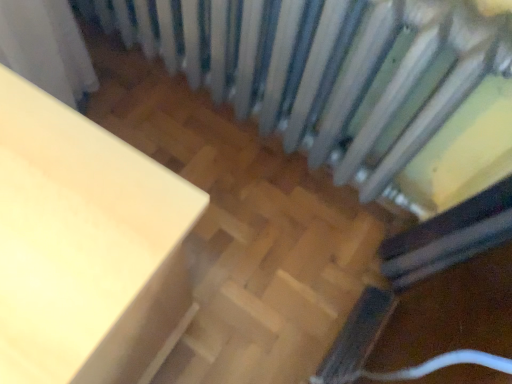
Identify the location of white painted radiator at upper center. (331, 72).

The image size is (512, 384). Describe the element at coordinates (331, 72) in the screenshot. I see `white painted radiator at upper center` at that location.

Image resolution: width=512 pixels, height=384 pixels. What do you see at coordinates (85, 246) in the screenshot? I see `matte white table at left` at bounding box center [85, 246].

The width and height of the screenshot is (512, 384). I want to click on matte white table at left, so [x=85, y=246].

The image size is (512, 384). Find the location of `white painted radiator at upper center`. white painted radiator at upper center is located at coordinates (331, 72).

Is white painted radiator at upper center at the right side of matte white table at left?

Indeed, white painted radiator at upper center is positioned on the right side of matte white table at left.

Is white painted radiator at upper center in front of or behind matte white table at left in the image?

In the image, white painted radiator at upper center appears behind matte white table at left.

Does point (149, 31) come in front of point (142, 238)?

No.

From the image's perspective, is white painted radiator at upper center on top of matte white table at left?

Yes, from the image's perspective, white painted radiator at upper center is above matte white table at left.

From a real-world perspective, which is physically below, white painted radiator at upper center or matte white table at left?

matte white table at left is physically lower.

Between white painted radiator at upper center and matte white table at left, which one has larger width?

matte white table at left is wider.

Considering the sizes of objects white painted radiator at upper center and matte white table at left in the image provided, who is taller, white painted radiator at upper center or matte white table at left?

matte white table at left.

Considering the relative sizes of white painted radiator at upper center and matte white table at left in the image provided, is white painted radiator at upper center bigger than matte white table at left?

No.

Do you think white painted radiator at upper center is within matte white table at left, or outside of it?

The correct answer is: outside.

In the scene shown: Is white painted radiator at upper center far from matte white table at left?

white painted radiator at upper center is near matte white table at left, not far away.

Is white painted radiator at upper center oriented away from matte white table at left?

Yes, matte white table at left is at the back of white painted radiator at upper center.

Can you tell me how much white painted radiator at upper center and matte white table at left differ in facing direction?

There is a 2.86-degree angle between the facing directions of white painted radiator at upper center and matte white table at left.

In the image, there is a white painted radiator at upper center. Where is `furniture below it (from a real-world perspective)`? Image resolution: width=512 pixels, height=384 pixels. furniture below it (from a real-world perspective) is located at coordinates (85, 246).

In the image, is matte white table at left on the left side or the right side of white painted radiator at upper center?

matte white table at left is to the left of white painted radiator at upper center.

Is matte white table at left positioned in front of white painted radiator at upper center?

Yes, matte white table at left is in front of white painted radiator at upper center.

Does point (182, 272) come farther from viewer compared to point (381, 180)?

That is False.

From the image's perspective, who appears lower, matte white table at left or white painted radiator at upper center?

From the image's view, matte white table at left is below.

From a real-world perspective, does matte white table at left stand above white painted radiator at upper center?

No, from a real-world perspective, matte white table at left is not over white painted radiator at upper center

Looking at their sizes, would you say matte white table at left is wider or thinner than white painted radiator at upper center?

In the image, matte white table at left appears to be wider than white painted radiator at upper center.

Is matte white table at left shorter than white painted radiator at upper center?

In fact, matte white table at left may be taller than white painted radiator at upper center.

Is matte white table at left bigger or smaller than white painted radiator at upper center?

Considering their sizes, matte white table at left takes up more space than white painted radiator at upper center.

Consider the image. Is matte white table at left inside or outside of white painted radiator at upper center?

matte white table at left is not enclosed by white painted radiator at upper center.

Are matte white table at left and white painted radiator at upper center far apart?

That's not correct — matte white table at left is a little close to white painted radiator at upper center.

Is matte white table at left facing away from white painted radiator at upper center?

Yes, matte white table at left is facing away from white painted radiator at upper center.

Image resolution: width=512 pixels, height=384 pixels. I want to click on radiator that appears on the right of matte white table at left, so click(x=331, y=72).

I want to click on radiator that is above the matte white table at left (from a real-world perspective), so click(x=331, y=72).

The image size is (512, 384). In order to click on radiator located on the right of matte white table at left in this screenshot , I will do (x=331, y=72).